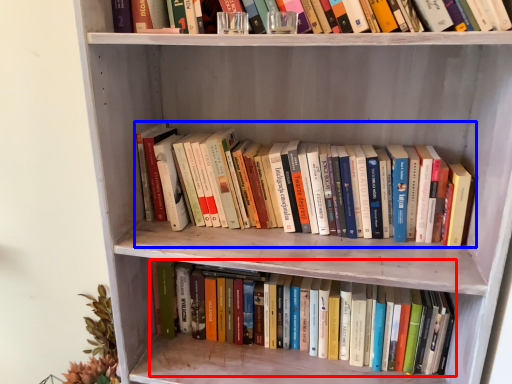
Question: Among these objects, which one is farthest to the camera, book (highlighted by a red box) or book (highlighted by a blue box)?

Choices:
 (A) book
 (B) book

Answer: (A)